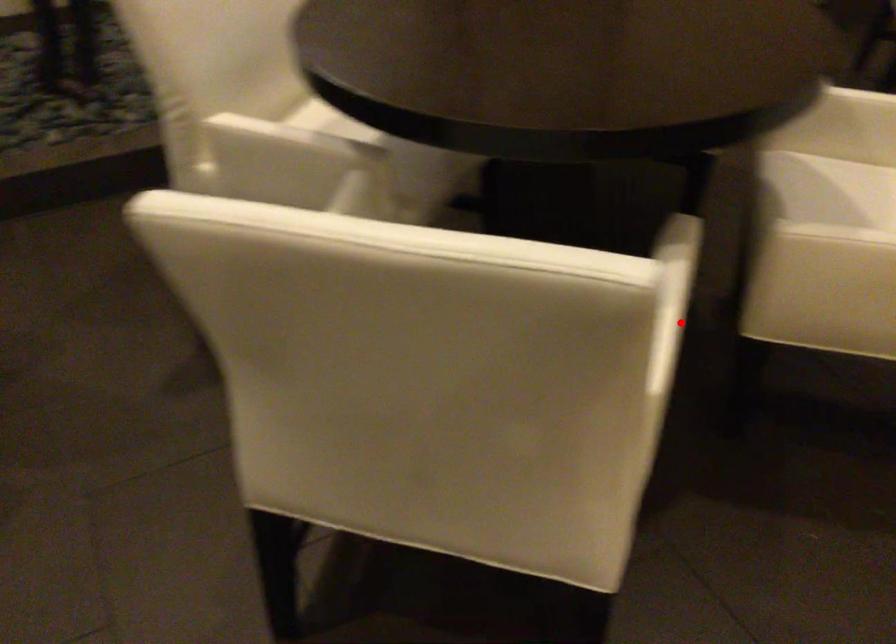
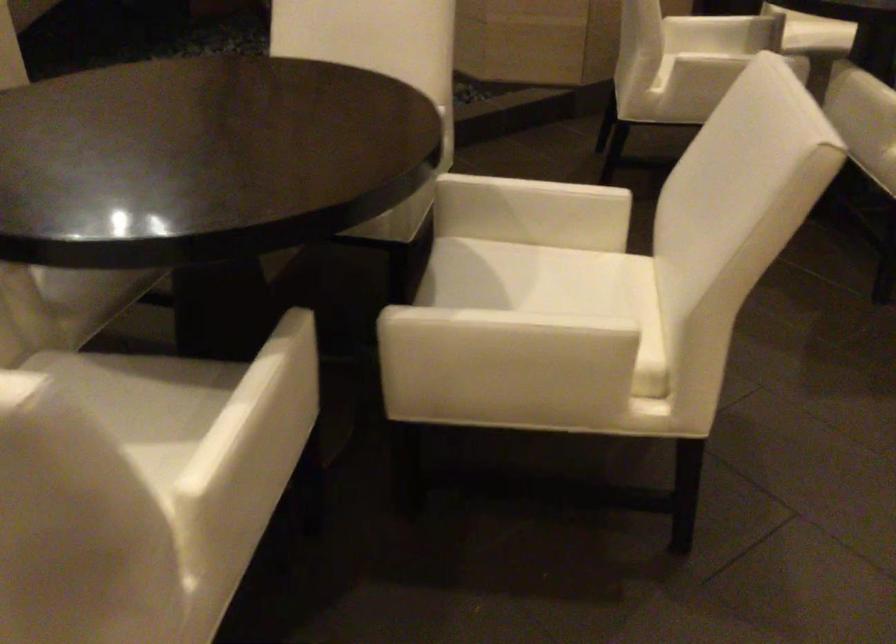
Find the pixel in the second image that matches the highlighted location in the first image.

(299, 413)